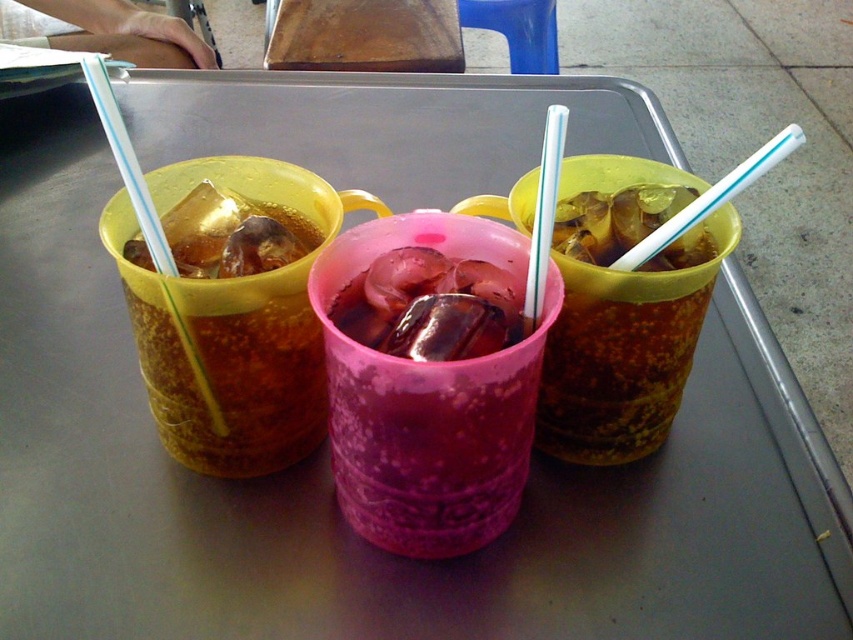
You are at a picnic and need to grab a drink quickly. You see the translucent yellow cup at right and the transparent plastic straw at left. Which one is positioned farther to the right?

The translucent yellow cup at right is positioned farther to the right than the transparent plastic straw at left.

Consider the image. You are at a party and want to choose the wider cup between the translucent yellow cup at left and the translucent yellow cup at center. Which one should you pick?

The translucent yellow cup at left is wider than the translucent yellow cup at center, so you should pick the translucent yellow cup at left.

You are arranging drinks on a tray and need to place a new cup exactly 0.1 units to the left of the translucent yellow cup at right. Where should you place the new cup?

The new cup should be placed at point 0.577 minus 0.1 equals 0.477, so coordinate (614, 305).